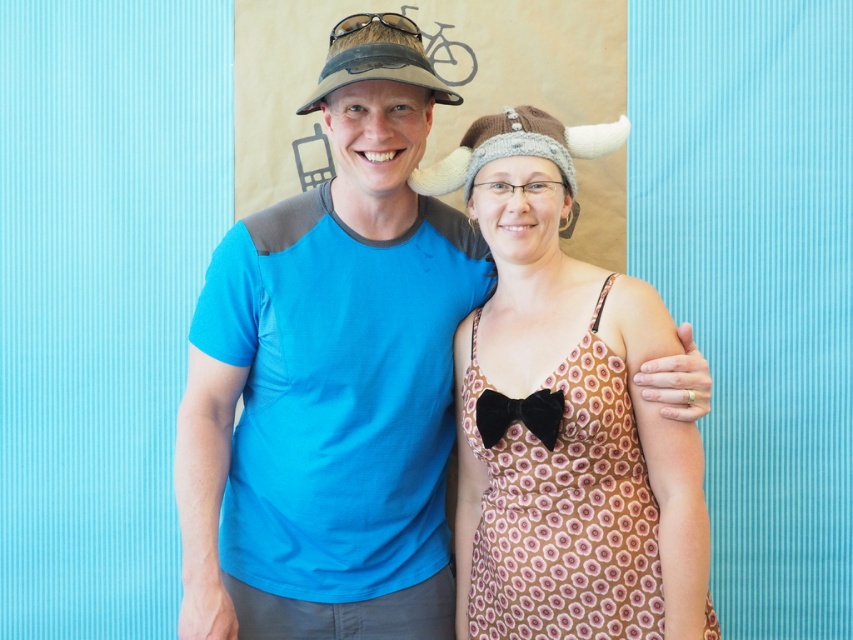
You are a photographer trying to capture a closeup shot of the brown fabric hat at upper center without including the brown textured dress at center in the frame. Based on their distance, is this possible?

The brown textured dress at center is 44.23 centimeters from brown fabric hat at upper center. Since the distance is relatively close, it might be challenging to frame the hat without including the dress, but with careful positioning, it could be possible depending on the camera lens and angle used.